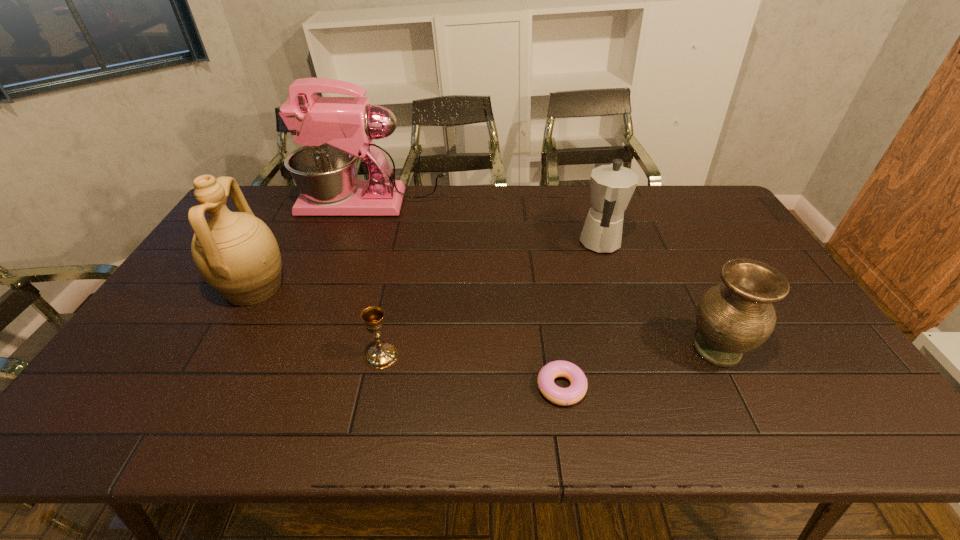
You are a GUI agent. You are given a task and a screenshot of the screen. Output one action in this format:
    pyautogui.click(x=<x>, y=<y>)
    Task: Click on the vacant space positioned on the face of the mixer
    The width and height of the screenshot is (960, 540).
    Given the screenshot: What is the action you would take?
    pyautogui.click(x=259, y=204)

Locate an element on the screen. The image size is (960, 540). vacant region located 0.080m on the face of the mixer is located at coordinates (278, 204).

Find the location of a particular element. The image size is (960, 540). free space located on the face of the mixer is located at coordinates (256, 204).

Identify the location of vacant region located on the right of the second tallest object. (393, 288).

Find the location of a particular element. Image resolution: width=960 pixels, height=540 pixels. free space located on the right of the fourth shortest object is located at coordinates (684, 244).

The width and height of the screenshot is (960, 540). I want to click on vacant space located on the back of the vase, so click(x=663, y=243).

Locate an element on the screen. vacant space located on the right of the chalice is located at coordinates (426, 356).

The height and width of the screenshot is (540, 960). I want to click on vacant region located on the right of the fourth object from left to right, so click(x=646, y=387).

Find the location of a particular element. object that is positioned at the far edge is located at coordinates (335, 131).

This screenshot has height=540, width=960. Identify the location of object located in the near edge section of the desktop. (576, 391).